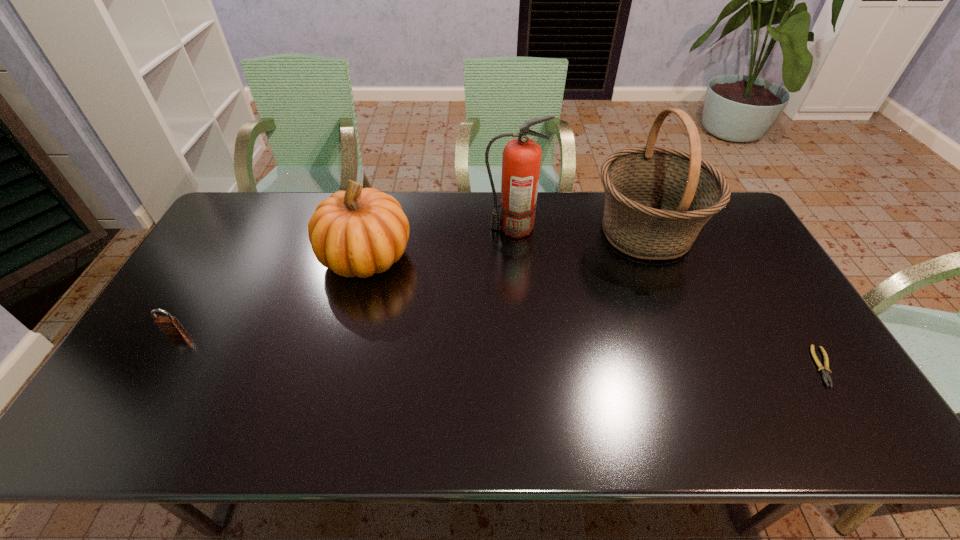
Find the location of a particular element. This screenshot has width=960, height=540. pliers at the right edge is located at coordinates (825, 371).

Locate an element on the screen. The width and height of the screenshot is (960, 540). object at the far right corner is located at coordinates (657, 199).

In the image, there is a desktop. Find the location of `free space at the far edge`. free space at the far edge is located at coordinates (289, 198).

In the image, there is a desktop. Identify the location of vacant space at the near edge. The height and width of the screenshot is (540, 960). (587, 426).

This screenshot has width=960, height=540. Find the location of `vacant area at the left edge`. vacant area at the left edge is located at coordinates (196, 277).

I want to click on free space at the right edge of the desktop, so click(x=746, y=247).

You are a GUI agent. You are given a task and a screenshot of the screen. Output one action in this format:
    pyautogui.click(x=<x>, y=<y>)
    Task: Click on the vacant space at the near right corner of the desktop
    
    Given the screenshot: What is the action you would take?
    pyautogui.click(x=840, y=414)

Where is `free point between the fourth object from right to left and the rightmost object`? This screenshot has height=540, width=960. free point between the fourth object from right to left and the rightmost object is located at coordinates (595, 312).

Image resolution: width=960 pixels, height=540 pixels. In order to click on free space that is in between the third object from right to left and the basket in this screenshot , I will do `click(579, 230)`.

The height and width of the screenshot is (540, 960). What are the coordinates of `vacant space in between the rightmost object and the second object from right to left` in the screenshot? It's located at point(734,299).